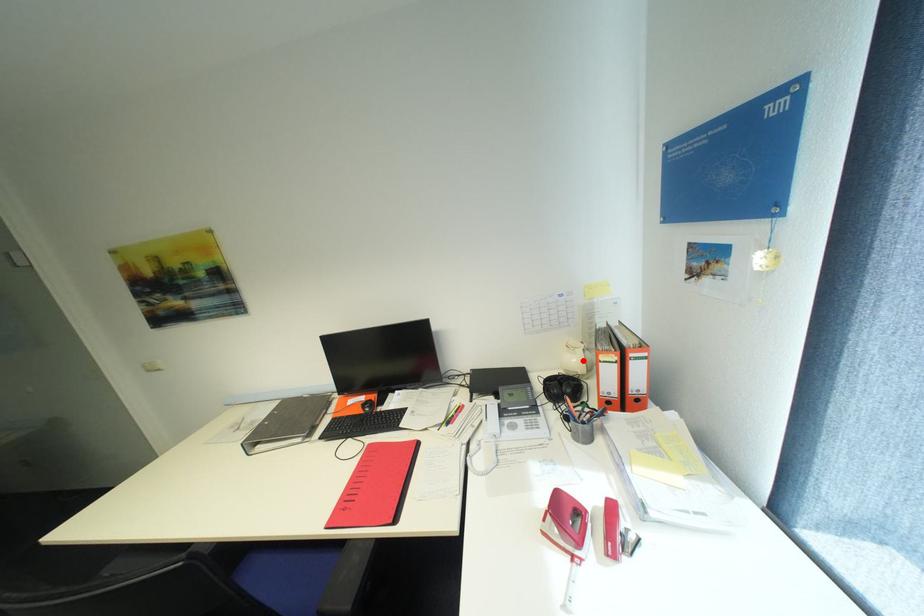
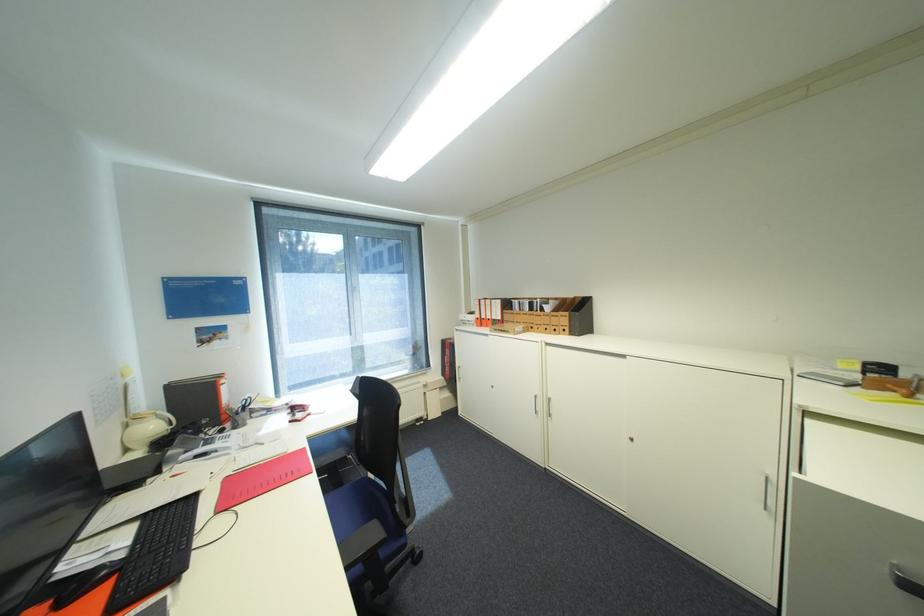
Locate, in the second image, the point that corresponds to the highlighted location in the first image.

(161, 427)